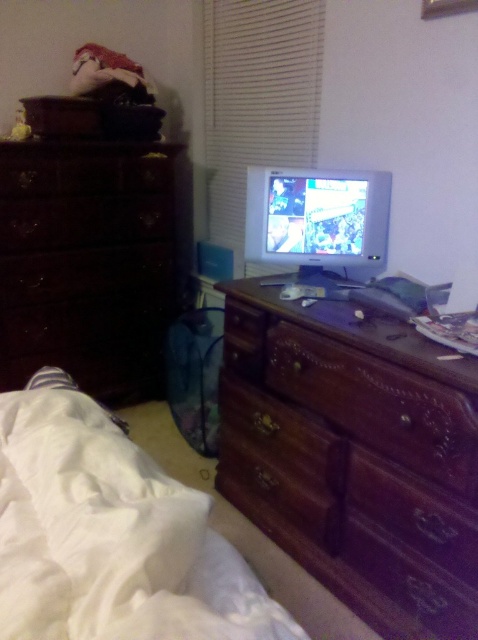
Which is behind, point (246, 376) or point (291, 100)?

Point (291, 100)

Identify the location of mahogany wood dresser at center. This screenshot has height=640, width=478. (355, 456).

I want to click on mahogany wood dresser at center, so click(x=355, y=456).

Can you confirm if mahogany wood dresser at center is positioned below white soft bed at lower left?

Yes, mahogany wood dresser at center is below white soft bed at lower left.

Between mahogany wood dresser at center and white soft bed at lower left, which one appears on the left side from the viewer's perspective?

white soft bed at lower left is more to the left.

You are a GUI agent. You are given a task and a screenshot of the screen. Output one action in this format:
    pyautogui.click(x=<x>, y=<y>)
    Task: Click on the mahogany wood dresser at center
    Image resolution: width=478 pixels, height=640 pixels.
    Given the screenshot: What is the action you would take?
    pyautogui.click(x=355, y=456)

Identify the location of mahogany wood dresser at center. The image size is (478, 640). (355, 456).

Does mahogany wood dresser at center have a lesser height compared to dark wood dresser at left?

Indeed, mahogany wood dresser at center has a lesser height compared to dark wood dresser at left.

Who is positioned more to the right, mahogany wood dresser at center or dark wood dresser at left?

mahogany wood dresser at center is more to the right.

Does point (421, 544) come behind point (139, 291)?

No, it is in front of (139, 291).

Locate an element on the screen. Image resolution: width=478 pixels, height=640 pixels. mahogany wood dresser at center is located at coordinates (355, 456).